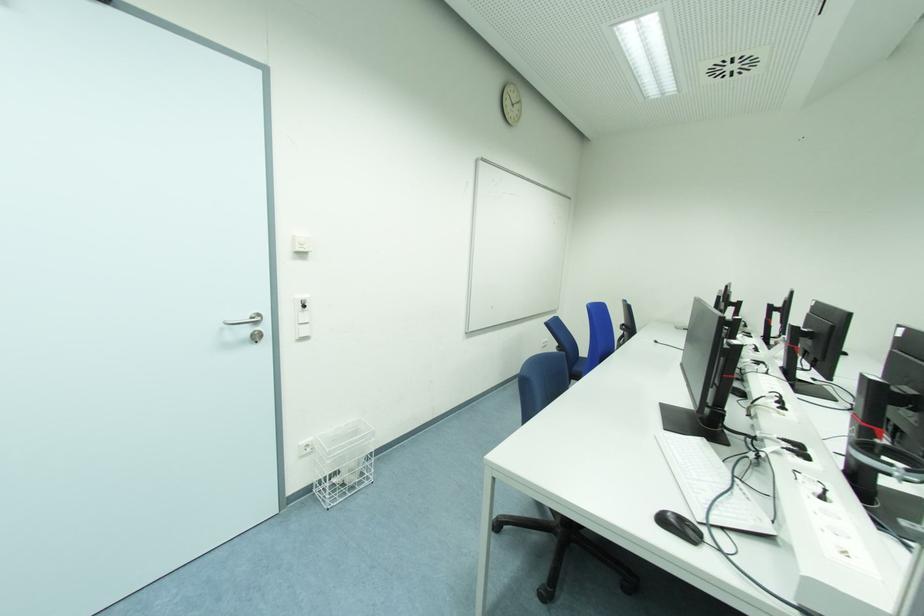
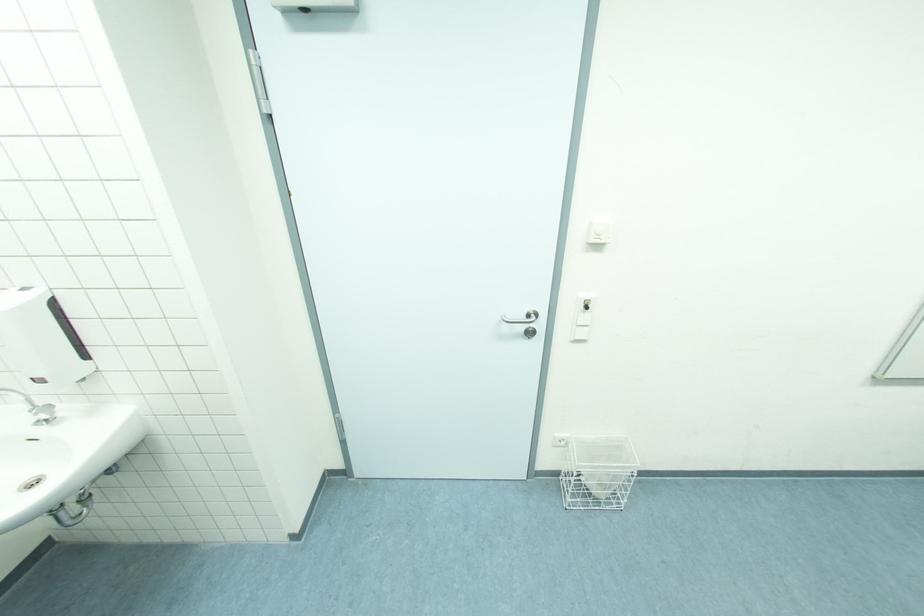
In the second image, find the point that corresponds to pixel 314 487 in the first image.

(563, 472)